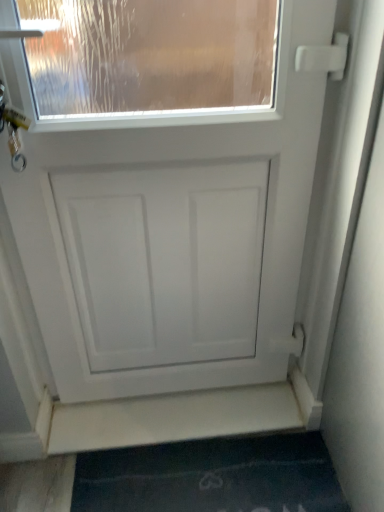
The image size is (384, 512). In order to click on free point above dark blue carpet at lower center (from a real-world perspective) in this screenshot , I will do `click(218, 475)`.